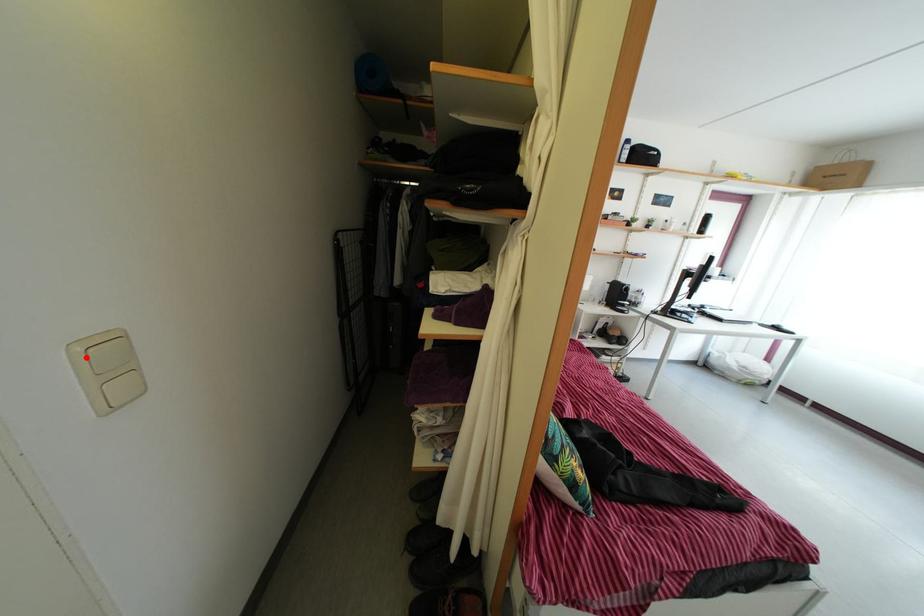
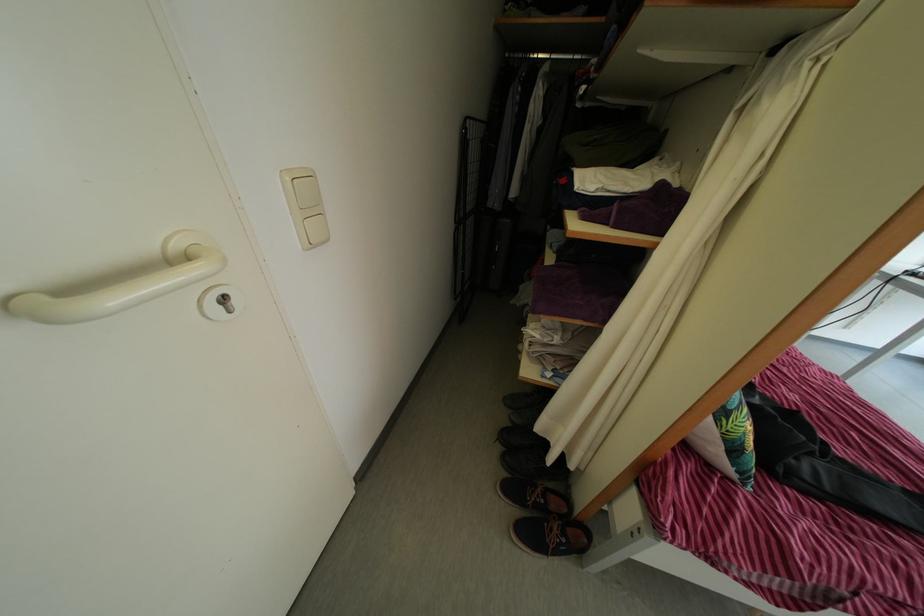
Locate, in the second image, the point that corresponds to the highlighted location in the first image.

(295, 187)